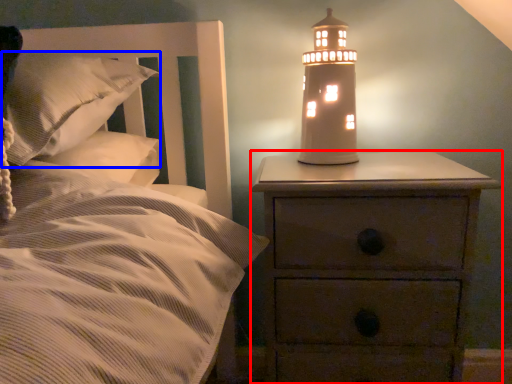
Question: Among these objects, which one is farthest to the camera, nightstand (highlighted by a red box) or pillow (highlighted by a blue box)?

Choices:
 (A) nightstand
 (B) pillow

Answer: (A)